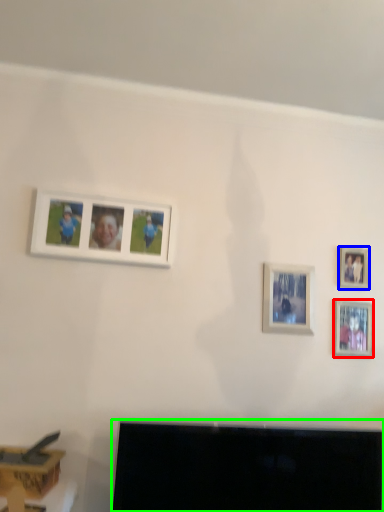
Question: Considering the real-world distances, which object is farthest from picture frame (highlighted by a red box)? picture frame (highlighted by a blue box) or television (highlighted by a green box)?

Choices:
 (A) picture frame
 (B) television

Answer: (B)